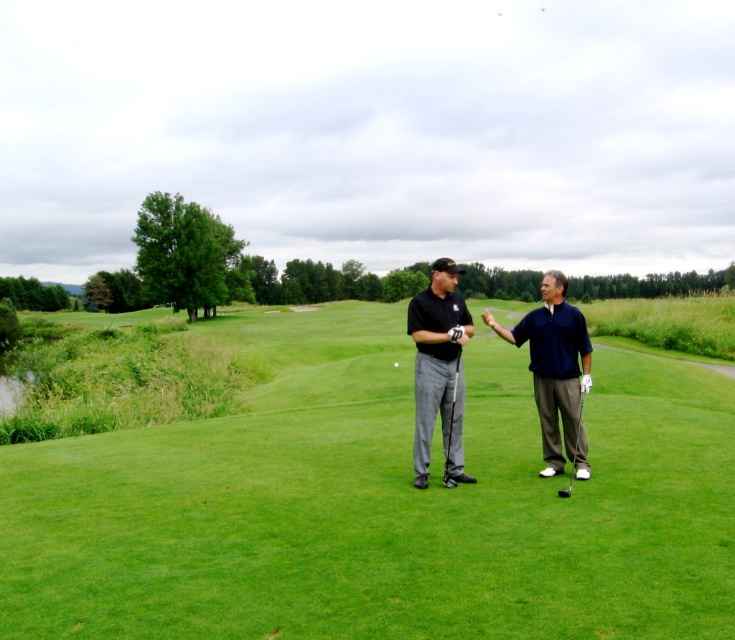
Question: Can you confirm if green grass at center is thinner than white matte golf ball at center?

Choices:
 (A) no
 (B) yes

Answer: (A)

Question: From the image, what is the correct spatial relationship of matte black golf clubs at center in relation to metallic gray golf club at center?

Choices:
 (A) below
 (B) above

Answer: (B)

Question: Among these points, which one is farthest from the camera?

Choices:
 (A) (395, 362)
 (B) (1, 595)
 (C) (445, 454)
 (D) (442, 257)

Answer: (D)

Question: Which is nearer to the metallic gray golf club at center?

Choices:
 (A) metallic silver golf club at center
 (B) matte black golf clubs at center
 (C) green grass at center

Answer: (B)

Question: Is green grass at center smaller than matte black shirt at center?

Choices:
 (A) yes
 (B) no

Answer: (B)

Question: Which object appears farthest from the camera in this image?

Choices:
 (A) metallic silver golf club at center
 (B) matte black shirt at center
 (C) white matte golf ball at center
 (D) matte black golf clubs at center

Answer: (C)